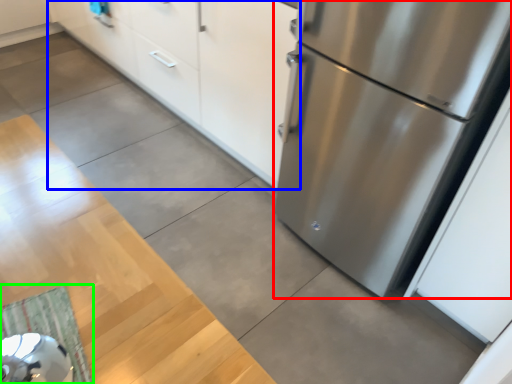
Question: Estimate the real-world distances between objects in this image. Which object is closer to refrigerator (highlighted by a red box), cabinetry (highlighted by a blue box) or doormat (highlighted by a green box)?

Choices:
 (A) cabinetry
 (B) doormat

Answer: (A)